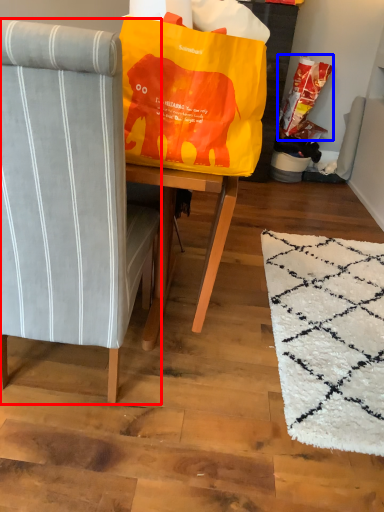
Question: Which of the following is the closest to the observer, chair (highlighted by a red box) or grocery bag (highlighted by a blue box)?

Choices:
 (A) chair
 (B) grocery bag

Answer: (A)